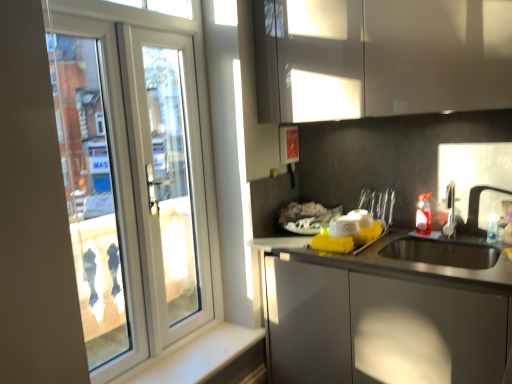
Question: Is satin nickel faucet at sink right shorter than white plastic door at left?

Choices:
 (A) yes
 (B) no

Answer: (A)

Question: Is satin nickel faucet at sink right outside of white plastic door at left?

Choices:
 (A) no
 (B) yes

Answer: (B)

Question: Are satin nickel faucet at sink right and white plastic door at left making contact?

Choices:
 (A) yes
 (B) no

Answer: (B)

Question: Is satin nickel faucet at sink right at the left side of white plastic door at left?

Choices:
 (A) yes
 (B) no

Answer: (B)

Question: From a real-world perspective, does satin nickel faucet at sink right sit lower than white plastic door at left?

Choices:
 (A) yes
 (B) no

Answer: (A)

Question: Is satin nickel faucet at sink right oriented towards white plastic door at left?

Choices:
 (A) yes
 (B) no

Answer: (B)

Question: Would you say glossy white cabinet at upper center is part of white plastic door at left's contents?

Choices:
 (A) no
 (B) yes

Answer: (A)

Question: Is white plastic door at left shorter than glossy white cabinet at upper center?

Choices:
 (A) no
 (B) yes

Answer: (A)

Question: From the image's perspective, is white plastic door at left located beneath glossy white cabinet at upper center?

Choices:
 (A) no
 (B) yes

Answer: (B)

Question: Is white plastic door at left at the right side of glossy white cabinet at upper center?

Choices:
 (A) no
 (B) yes

Answer: (A)

Question: Is white plastic door at left taller than glossy white cabinet at upper center?

Choices:
 (A) yes
 (B) no

Answer: (A)

Question: Considering the relative sizes of white plastic door at left and glossy white cabinet at upper center in the image provided, is white plastic door at left smaller than glossy white cabinet at upper center?

Choices:
 (A) no
 (B) yes

Answer: (B)

Question: Is white smooth window sill at lower left in contact with glossy white cabinet at upper center?

Choices:
 (A) no
 (B) yes

Answer: (A)